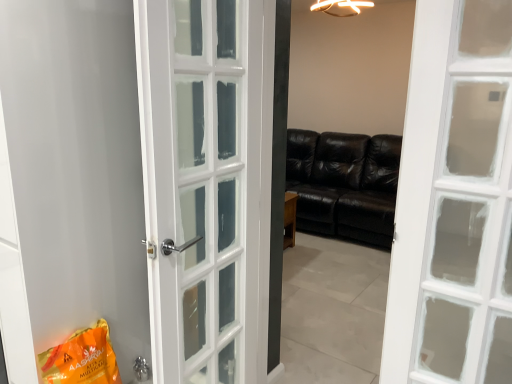
Question: Can you confirm if orange matte shopping bag at lower left is wider than white glossy door at left?

Choices:
 (A) no
 (B) yes

Answer: (A)

Question: Is orange matte shopping bag at lower left positioned in front of white glossy door at left?

Choices:
 (A) yes
 (B) no

Answer: (B)

Question: Is orange matte shopping bag at lower left shorter than white glossy door at left?

Choices:
 (A) no
 (B) yes

Answer: (B)

Question: Are orange matte shopping bag at lower left and white glossy door at left located far from each other?

Choices:
 (A) yes
 (B) no

Answer: (B)

Question: Could you tell me if orange matte shopping bag at lower left is facing white glossy door at left?

Choices:
 (A) no
 (B) yes

Answer: (A)

Question: From their relative heights in the image, would you say white glossy door at left is taller or shorter than orange matte shopping bag at lower left?

Choices:
 (A) short
 (B) tall

Answer: (B)

Question: Considering the positions of white glossy door at left and orange matte shopping bag at lower left in the image, is white glossy door at left wider or thinner than orange matte shopping bag at lower left?

Choices:
 (A) thin
 (B) wide

Answer: (B)

Question: Is point (115, 119) closer or farther from the camera than point (96, 344)?

Choices:
 (A) closer
 (B) farther

Answer: (B)

Question: Considering the positions of white glossy door at left and orange matte shopping bag at lower left in the image, is white glossy door at left bigger or smaller than orange matte shopping bag at lower left?

Choices:
 (A) big
 (B) small

Answer: (A)

Question: From a real-world perspective, is orange matte shopping bag at lower left above or below polished silver door handle at lower center?

Choices:
 (A) below
 (B) above

Answer: (B)

Question: Considering the positions of orange matte shopping bag at lower left and polished silver door handle at lower center in the image, is orange matte shopping bag at lower left taller or shorter than polished silver door handle at lower center?

Choices:
 (A) short
 (B) tall

Answer: (B)

Question: In terms of width, does orange matte shopping bag at lower left look wider or thinner when compared to polished silver door handle at lower center?

Choices:
 (A) thin
 (B) wide

Answer: (B)

Question: Do you think orange matte shopping bag at lower left is within polished silver door handle at lower center, or outside of it?

Choices:
 (A) outside
 (B) inside

Answer: (A)

Question: Looking at the image, does polished silver door handle at lower center seem bigger or smaller compared to white glossy door at left?

Choices:
 (A) small
 (B) big

Answer: (A)

Question: Which is correct: polished silver door handle at lower center is inside white glossy door at left, or outside of it?

Choices:
 (A) outside
 (B) inside

Answer: (B)